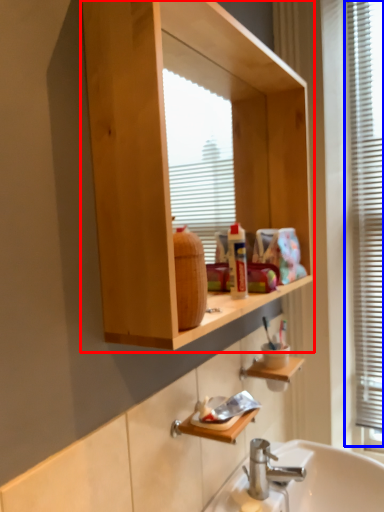
Question: Which object is closer to the camera taking this photo, bathroom cabinet (highlighted by a red box) or window frame (highlighted by a blue box)?

Choices:
 (A) bathroom cabinet
 (B) window frame

Answer: (A)